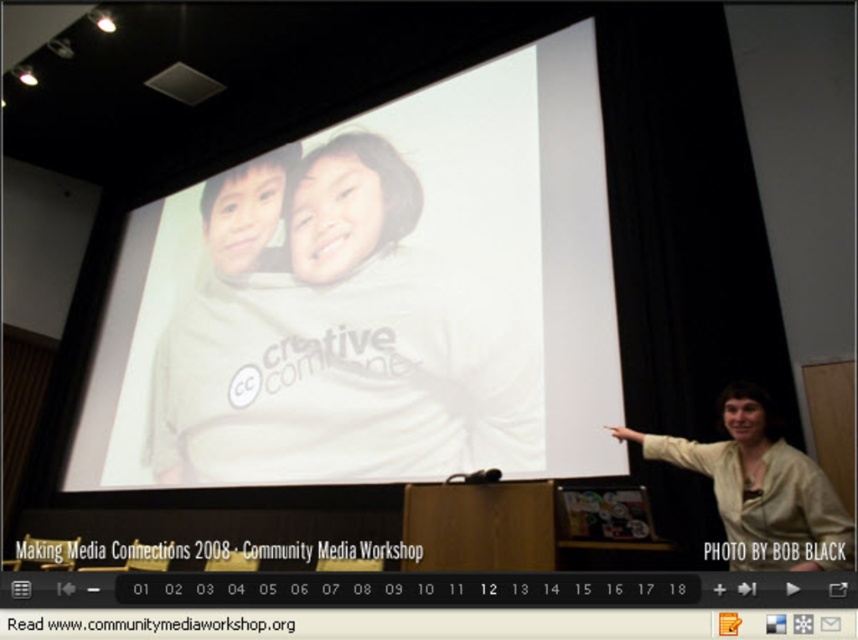
You are organizing a photo exhibition and need to ensure that the matte beige hoodie at center and the yellow fabric at right can fit on a display stand that is 1 meter wide. Based on their sizes, will both items fit together on the stand?

The matte beige hoodie at center is wider than the yellow fabric at right, but since the total width of both items combined is not provided, it is impossible to determine if they will fit on the 1 meter wide display stand. Additional information about their individual widths is needed.

You are an attendee at the presentation and want to take a photo of the white matte screen at center and the matte beige hoodie at center. Which object should you focus on first if you want to capture both in the same frame without moving the camera?

The white matte screen at center is taller than the matte beige hoodie at center, so you should focus on the white matte screen at center first to ensure it fits within the frame.

You are an event organizer setting up the conference room. You need to place a new banner on the light beige fabric at center. Where should you position it relative to the white matte screen at center?

The white matte screen at center is positioned on the right side of the light beige fabric at center, so you should place the banner to the left of the white matte screen at center to align with the light beige fabric at center.